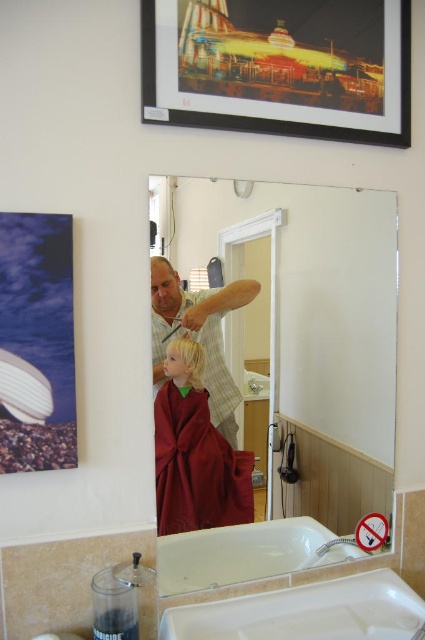
Between point (238, 202) and point (402, 632), which one is positioned behind?

The point (238, 202) is more distant.

Is point (333, 211) behind point (337, 605)?

Yes, it is.

In order to click on clear glass mirror at upper center in this screenshot , I will do `click(291, 364)`.

Who is positioned more to the right, matte red cape at center or blonde hair at upper center?

matte red cape at center

The width and height of the screenshot is (425, 640). What are the coordinates of `matte red cape at center` in the screenshot? It's located at (195, 452).

What are the coordinates of `matte red cape at center` in the screenshot? It's located at (195, 452).

Is point (192, 307) positioned before point (153, 257)?

No, (192, 307) is behind (153, 257).

Is matte green shirt at center thinner than blonde hair at upper center?

In fact, matte green shirt at center might be wider than blonde hair at upper center.

Is point (158, 323) positioned behind point (164, 260)?

No.

At what (x,y) coordinates should I click in order to perform the action: click on matte green shirt at center. Please return your answer as a coordinate pair (x, y). The width and height of the screenshot is (425, 640). Looking at the image, I should click on coord(200,337).